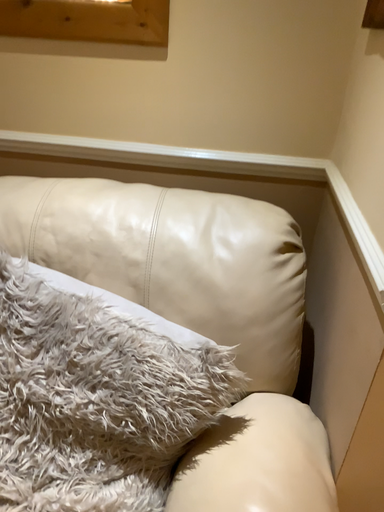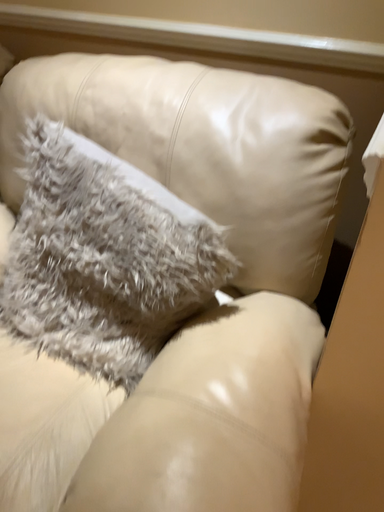
Question: Which way did the camera rotate in the video?

Choices:
 (A) rotated right
 (B) rotated left

Answer: (B)